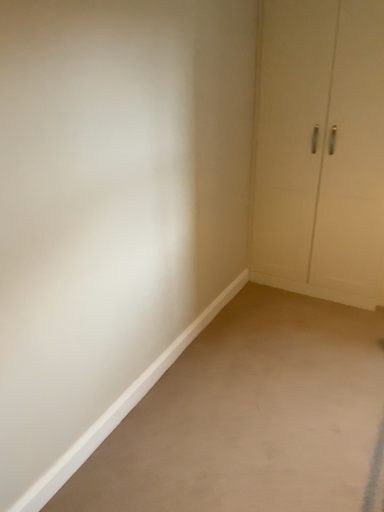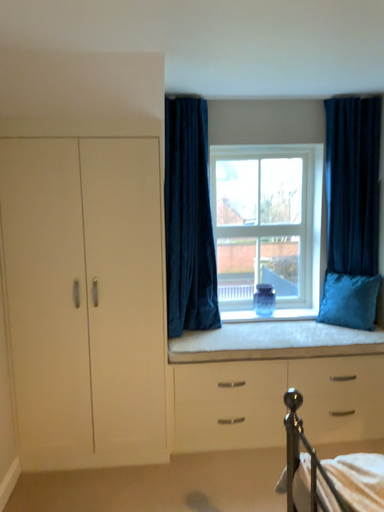
Question: How did the camera likely rotate when shooting the video?

Choices:
 (A) rotated downward
 (B) rotated upward

Answer: (B)